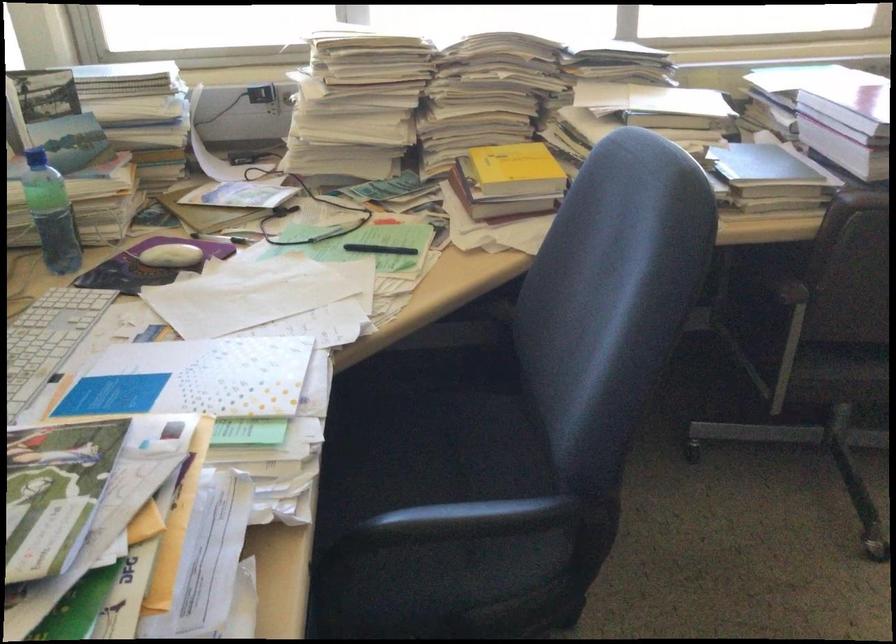
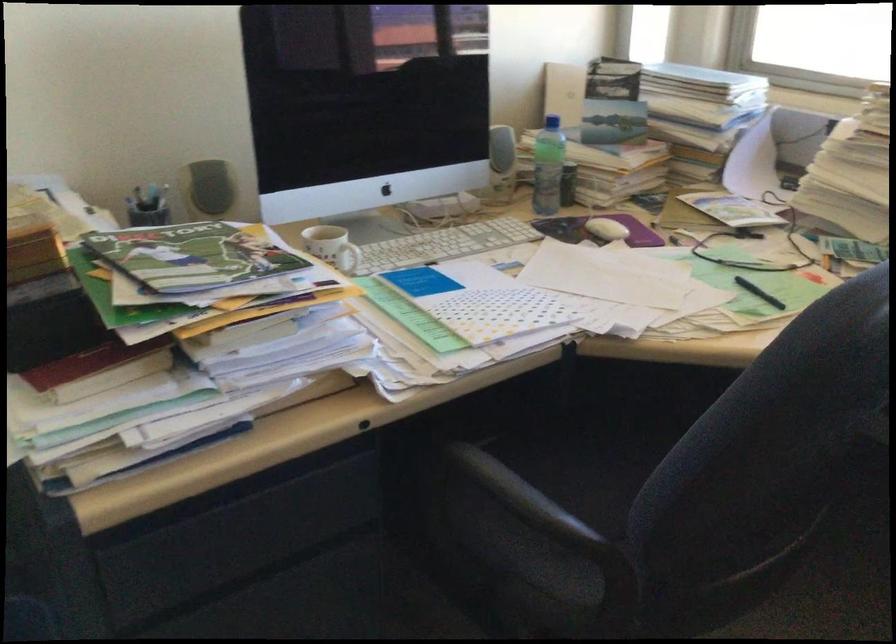
Locate, in the second image, the point that corresponds to (403,473) in the first image.

(616, 478)